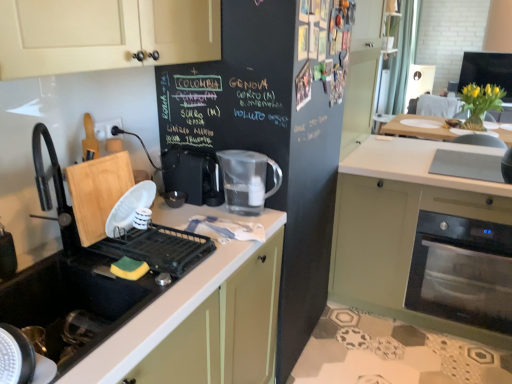
Question: Is green matte oven at lower right beside transparent plastic pitcher at center?

Choices:
 (A) no
 (B) yes

Answer: (A)

Question: Is green matte oven at lower right bigger than transparent plastic pitcher at center?

Choices:
 (A) yes
 (B) no

Answer: (A)

Question: Is green matte oven at lower right not close to transparent plastic pitcher at center?

Choices:
 (A) no
 (B) yes

Answer: (A)

Question: Is green matte oven at lower right smaller than transparent plastic pitcher at center?

Choices:
 (A) no
 (B) yes

Answer: (A)

Question: Is green matte oven at lower right turned away from transparent plastic pitcher at center?

Choices:
 (A) yes
 (B) no

Answer: (B)

Question: Considering the relative positions of green matte oven at lower right and transparent plastic pitcher at center in the image provided, is green matte oven at lower right to the left of transparent plastic pitcher at center from the viewer's perspective?

Choices:
 (A) yes
 (B) no

Answer: (B)

Question: Does black rubber sink at lower left have a lesser height compared to black plastic coffee machine at center?

Choices:
 (A) yes
 (B) no

Answer: (B)

Question: Is black rubber sink at lower left thinner than black plastic coffee machine at center?

Choices:
 (A) no
 (B) yes

Answer: (A)

Question: Are black rubber sink at lower left and black plastic coffee machine at center located far from each other?

Choices:
 (A) yes
 (B) no

Answer: (B)

Question: From a real-world perspective, is black rubber sink at lower left located beneath black plastic coffee machine at center?

Choices:
 (A) yes
 (B) no

Answer: (A)

Question: From the image's perspective, is black rubber sink at lower left over black plastic coffee machine at center?

Choices:
 (A) no
 (B) yes

Answer: (A)

Question: Is black rubber sink at lower left oriented away from black plastic coffee machine at center?

Choices:
 (A) yes
 (B) no

Answer: (B)

Question: Is green matte oven at lower right a part of black rubber sink at lower left?

Choices:
 (A) no
 (B) yes

Answer: (A)